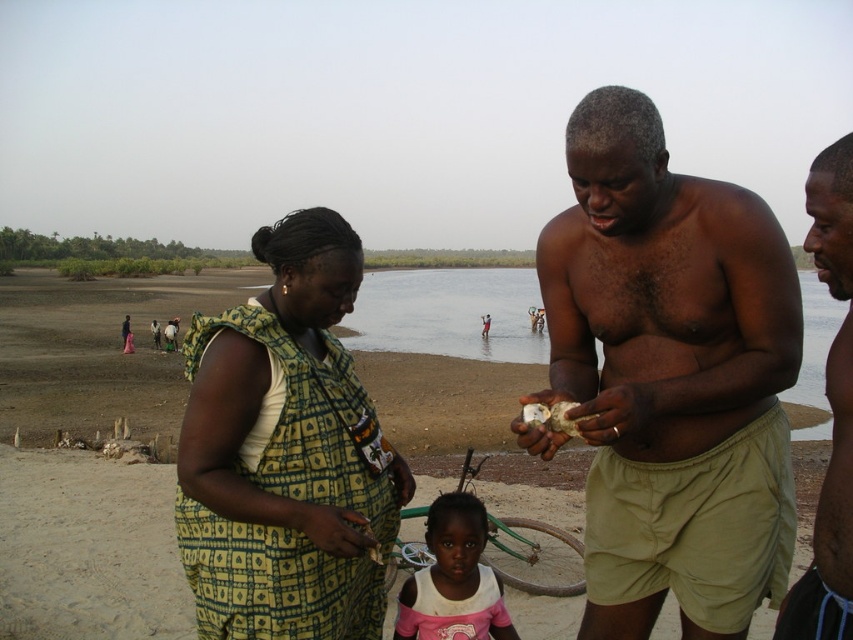
In the scene shown: You are a photographer trying to capture a photo of the beach scene. You want to ensure both the green printed fabric dress at left and the shiny black skin at center are clearly visible. Which object should you focus on first if you want to ensure both are in focus?

The green printed fabric dress at left has a lesser width compared to shiny black skin at center, so you should focus on the wider object, shiny black skin at center, first to ensure both are in focus.

You are a photographer standing at the center of the beach scene. You want to take a photo of the green printed fabric dress at left. What are the coordinates of the dress in the image?

The coordinates of the green printed fabric dress at left are at point (285,452).